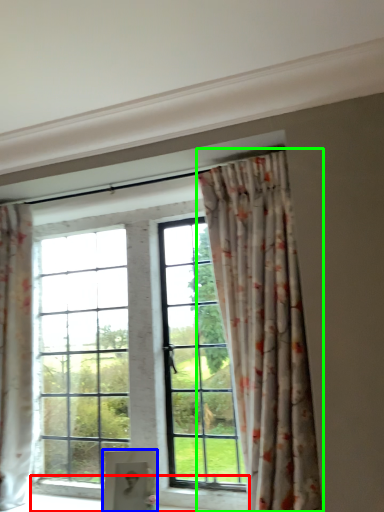
Question: Which object is positioned closest to window sill (highlighted by a red box)? Select from furniture (highlighted by a blue box) and curtain (highlighted by a green box).

Choices:
 (A) furniture
 (B) curtain

Answer: (A)